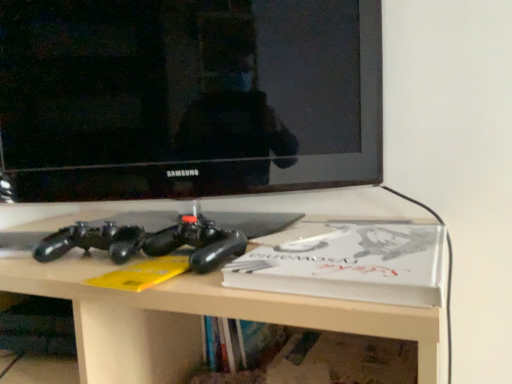
Question: From a real-world perspective, is matte black controller at center positioned above or below black glossy television at upper center?

Choices:
 (A) above
 (B) below

Answer: (B)

Question: Does point (442, 339) appear closer or farther from the camera than point (13, 67)?

Choices:
 (A) farther
 (B) closer

Answer: (A)

Question: Which of these objects is positioned closest to the black glossy television at upper center?

Choices:
 (A) matte black controller at center
 (B) white matte paperback book at center

Answer: (A)

Question: Which of these objects is positioned closest to the matte black controller at center?

Choices:
 (A) black glossy television at upper center
 (B) white matte paperback book at center

Answer: (B)